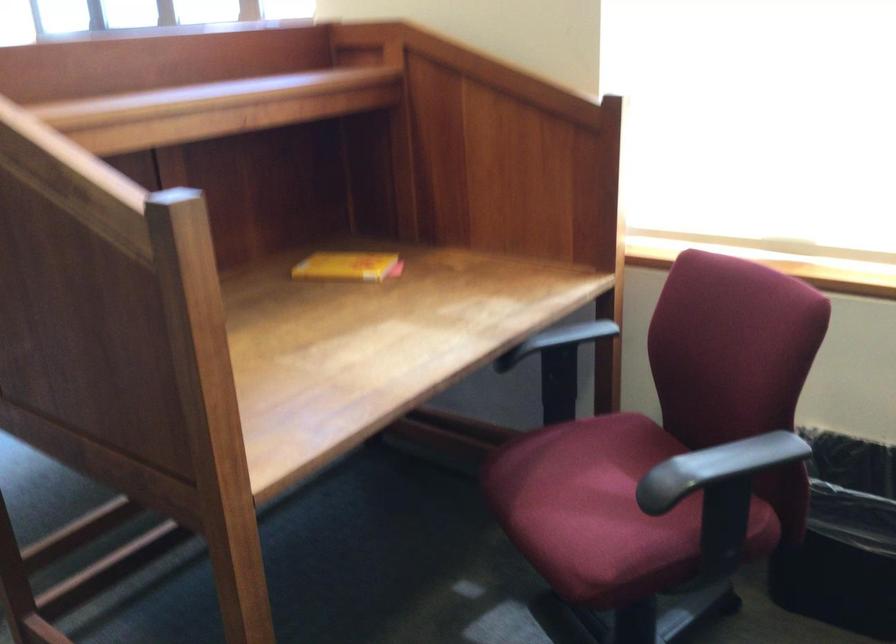
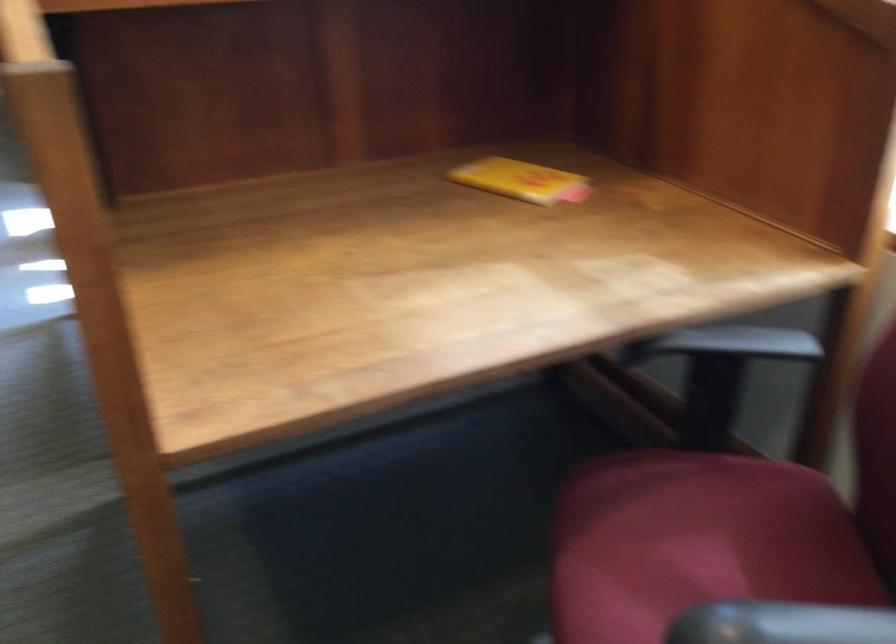
Locate, in the second image, the point that corresponds to the point at 702,465 in the first image.

(780, 623)